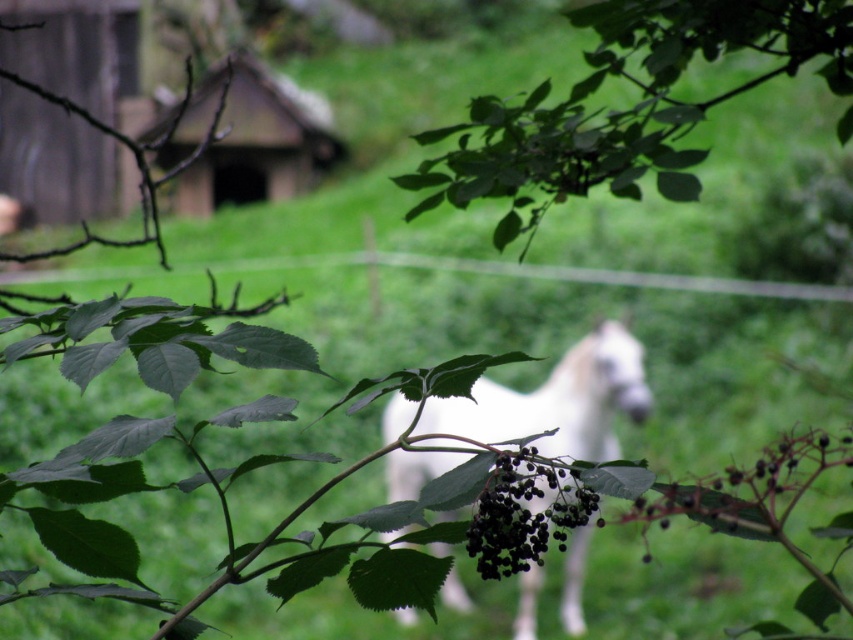
How much distance is there between green leafy branch at upper center and black matte berries at center?

green leafy branch at upper center is 26.00 inches from black matte berries at center.

The width and height of the screenshot is (853, 640). In order to click on green leafy branch at upper center in this screenshot , I will do `click(625, 108)`.

Is green leafy branch at upper center positioned in front of white glossy horse at center?

Yes, green leafy branch at upper center is closer to the viewer.

Between green leafy branch at upper center and white glossy horse at center, which one is positioned lower?

Positioned lower is white glossy horse at center.

Is point (787, 60) farther from camera compared to point (583, 552)?

No.

You are a GUI agent. You are given a task and a screenshot of the screen. Output one action in this format:
    pyautogui.click(x=<x>, y=<y>)
    Task: Click on the green leafy branch at upper center
    The width and height of the screenshot is (853, 640).
    Given the screenshot: What is the action you would take?
    pyautogui.click(x=625, y=108)

Is green leafy branch at upper center below wooden hut at upper center?

Indeed, green leafy branch at upper center is positioned under wooden hut at upper center.

Is green leafy branch at upper center behind wooden hut at upper center?

No, it is in front of wooden hut at upper center.

Between point (578, 144) and point (276, 83), which one is positioned behind?

The point (276, 83) is behind.

Where is `green leafy branch at upper center`? The image size is (853, 640). green leafy branch at upper center is located at coordinates (625, 108).